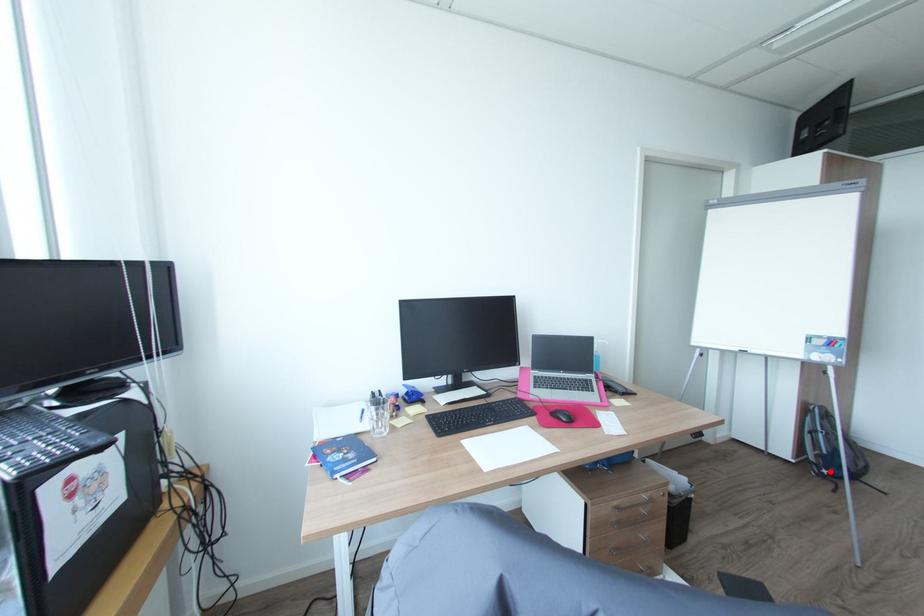
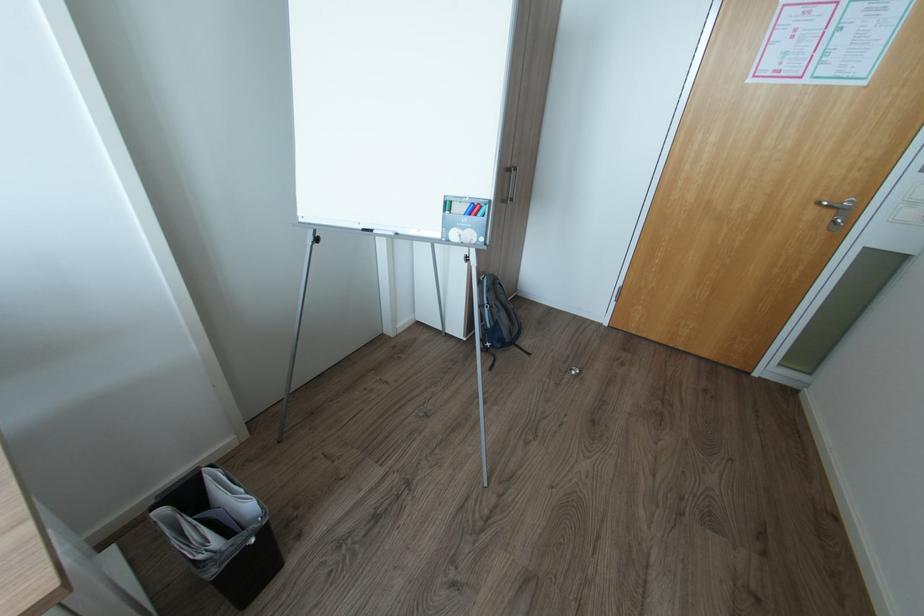
Question: I am providing you with two images of the same scene from different viewpoints. In image1, a red point is highlighted. Considering the same 3D point in image2, which of the following is correct?

Choices:
 (A) It is closer
 (B) It is farther

Answer: (B)